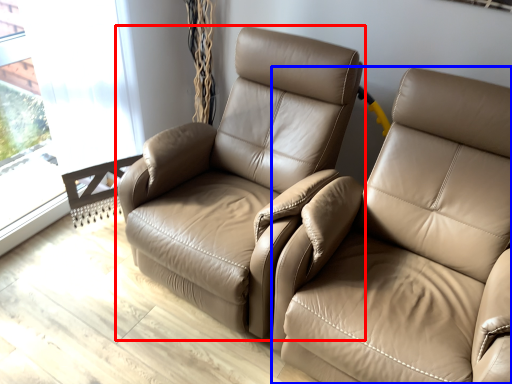
Question: Which of the following is the farthest to the observer, chair (highlighted by a red box) or studio couch (highlighted by a blue box)?

Choices:
 (A) chair
 (B) studio couch

Answer: (A)